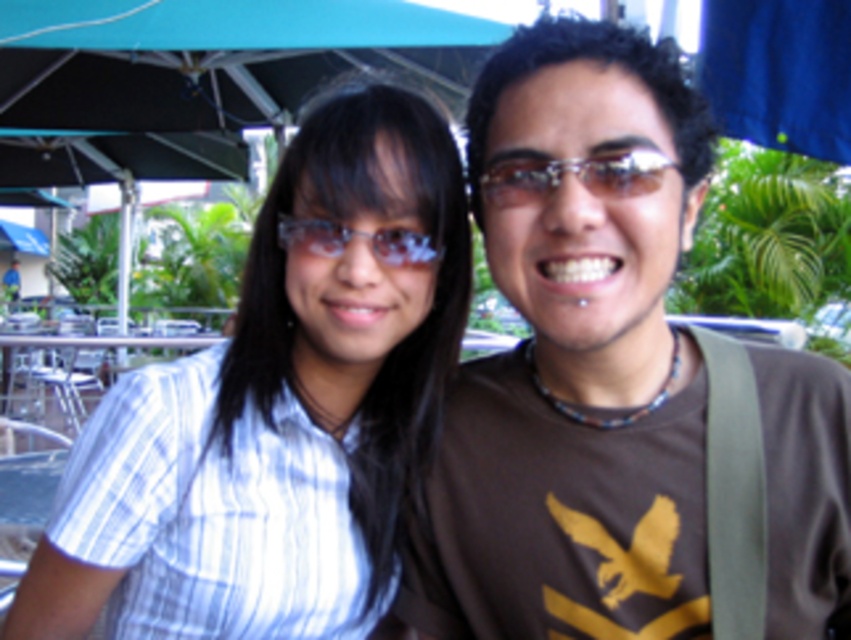
You are trying to decide which pair of glasses to take with you on a hike. You have the sunglasses at center and the transparent plastic glasses at center. Based on their sizes, which one might be easier to carry in a small bag?

The sunglasses at center has a smaller size compared to transparent plastic glasses at center, so the sunglasses at center would be easier to carry in a small bag.